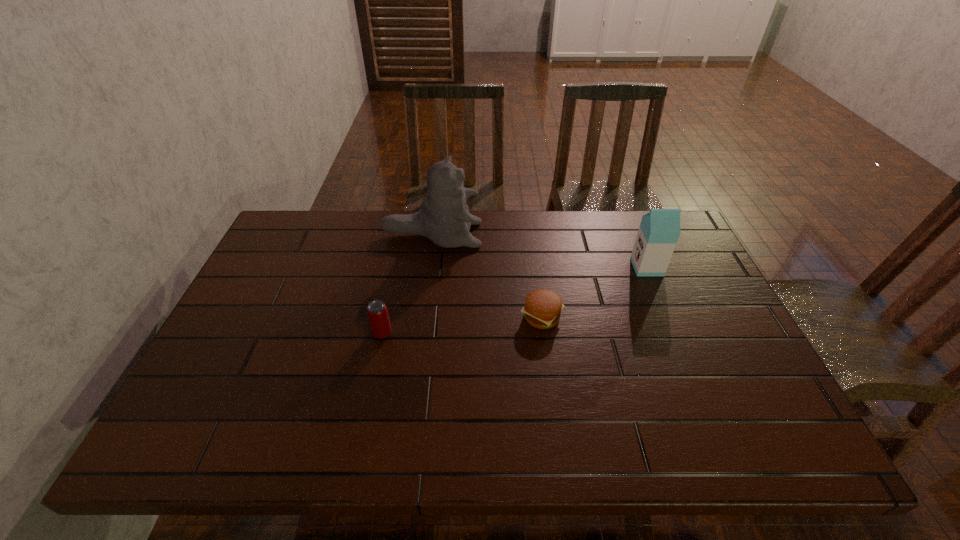
Find the location of `vacant region located 0.240m on the left of the third object from left to right`. vacant region located 0.240m on the left of the third object from left to right is located at coordinates (429, 317).

Locate an element on the screen. object at the far edge is located at coordinates (444, 218).

At what (x,y) coordinates should I click in order to perform the action: click on object that is at the right edge. Please return your answer as a coordinate pair (x, y). This screenshot has width=960, height=540. Looking at the image, I should click on (659, 230).

At what (x,y) coordinates should I click in order to perform the action: click on free space at the far edge of the desktop. Please return your answer as a coordinate pair (x, y). The image size is (960, 540). Looking at the image, I should click on (490, 246).

At what (x,y) coordinates should I click in order to perform the action: click on free space at the near edge of the desktop. Please return your answer as a coordinate pair (x, y). This screenshot has width=960, height=540. Looking at the image, I should click on (671, 452).

This screenshot has height=540, width=960. What are the coordinates of `vacant space at the left edge` in the screenshot? It's located at (252, 298).

At what (x,y) coordinates should I click in order to perform the action: click on vacant space at the right edge of the desktop. Please return your answer as a coordinate pair (x, y). Looking at the image, I should click on (688, 313).

Identify the location of blank area at the far left corner. [285, 240].

Image resolution: width=960 pixels, height=540 pixels. In order to click on empty space between the beer can and the tallest object in this screenshot , I will do click(x=407, y=284).

Where is `unoccupied area between the beer can and the tallest object`? This screenshot has height=540, width=960. unoccupied area between the beer can and the tallest object is located at coordinates (407, 284).